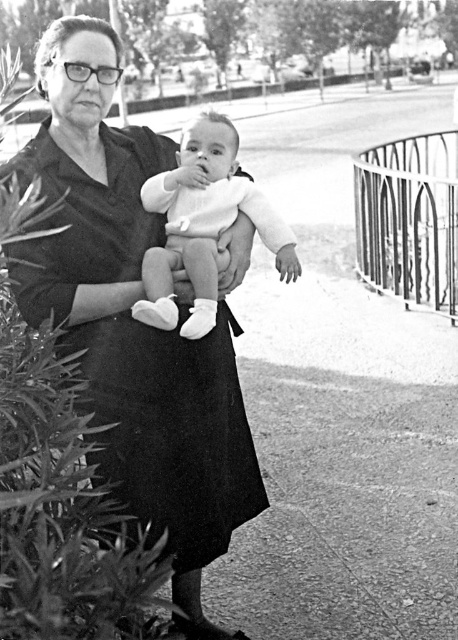
You are a photographer analyzing this image. You need to place a label for the black matte dress at center. What are the coordinates where you should place it?

The coordinates for the black matte dress at center are at point (170, 429).

Looking at this image, you are a photographer trying to capture a closeup shot of the black matte dress at center and the white soft baby at center. Since the camera can only focus on one subject at a time, which subject should you choose to ensure the taller one is in focus?

The black matte dress at center is taller than the white soft baby at center, so you should focus on the black matte dress at center to ensure the taller subject is in focus.

You are a photographer trying to capture a clear shot of the white soft baby at center. The black matte dress at center is blocking your view. Can you move the dress to the side to get a better angle?

The black matte dress at center is in front of the white soft baby at center, so moving the dress aside would allow you to see the baby clearly.